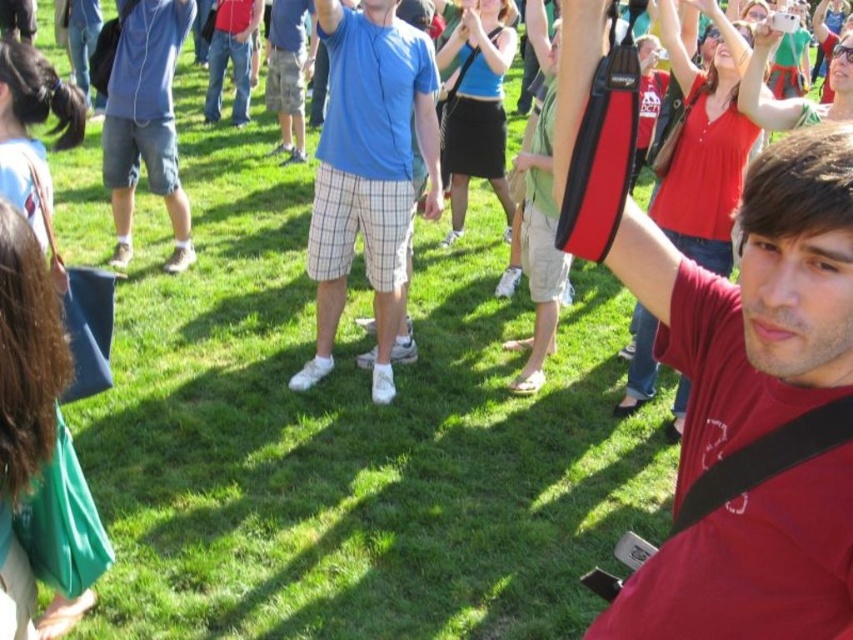
You are at an outdoor event and see two people wearing a matte red shirt at center and a blue cotton shirt at center. Which shirt is more to the right?

The matte red shirt at center is positioned on the right side of blue cotton shirt at center, so the matte red shirt at center is more to the right.

You are standing at the origin point of the coordinate system. You want to take a photo of the matte red shirt at center. In which direction should you move to get closer to it?

Since the matte red shirt at center is located at coordinate point 0.469 on the x axis and 0.886 on the y axis, you should move towards the right and forward direction to reach it.

You are at an outdoor event and want to take a photo of the matte red shirt at center and denim shorts at left. Which object should you focus on first if you want to capture both in the same frame without moving the camera?

The matte red shirt at center is thinner than denim shorts at left, so you should focus on the denim shorts at left first to ensure both are in focus since it is closer to the camera.